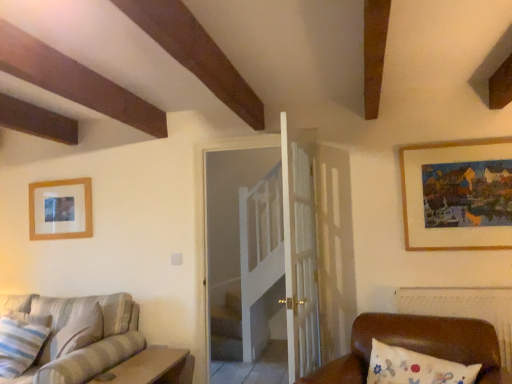
The image size is (512, 384). What do you see at coordinates (60, 209) in the screenshot? I see `matte white picture frame at upper left, which appears as the 1th picture frame when viewed from the back` at bounding box center [60, 209].

At what (x,y) coordinates should I click in order to perform the action: click on brown leather couch at lower right. Please return your answer as a coordinate pair (x, y). Looking at the image, I should click on (416, 346).

What do you see at coordinates (243, 250) in the screenshot?
I see `white wooden door at center` at bounding box center [243, 250].

What is the approximate height of striped fabric pillow at lower left?

20.71 inches.

You are a GUI agent. You are given a task and a screenshot of the screen. Output one action in this format:
    pyautogui.click(x=<x>, y=<y>)
    Task: Click on the matte white picture frame at upper left, placed as the 2th picture frame when sorted from front to back
    
    Given the screenshot: What is the action you would take?
    pyautogui.click(x=60, y=209)

Does point (269, 155) come farther from viewer compared to point (49, 192)?

Yes, it is.

Is white wooden door at center in front of matte white picture frame at upper left, which appears as the 1th picture frame when viewed from the back?

That is True.

Can you confirm if white wooden door at center is bigger than matte white picture frame at upper left, which appears as the 1th picture frame when viewed from the back?

Indeed, white wooden door at center has a larger size compared to matte white picture frame at upper left, which appears as the 1th picture frame when viewed from the back.

From a real-world perspective, is white wooden door at center located beneath matte white picture frame at upper left, which is the second picture frame in right-to-left order?

Yes, from a real-world perspective, white wooden door at center is beneath matte white picture frame at upper left, which is the second picture frame in right-to-left order.

In terms of size, does brown leather couch at lower right appear bigger or smaller than wooden framed painting at upper right, the 1th picture frame from the right?

In the image, brown leather couch at lower right appears to be larger than wooden framed painting at upper right, the 1th picture frame from the right.

How distant is brown leather couch at lower right from wooden framed painting at upper right, marked as the first picture frame in a front-to-back arrangement?

The distance of brown leather couch at lower right from wooden framed painting at upper right, marked as the first picture frame in a front-to-back arrangement, is 31.20 inches.

Looking at this image, is brown leather couch at lower right touching wooden framed painting at upper right, the 1th picture frame from the right?

No.

From a real-world perspective, does brown leather couch at lower right sit lower than wooden framed painting at upper right, the 1th picture frame from the right?

Correct, in the physical world, brown leather couch at lower right is lower than wooden framed painting at upper right, the 1th picture frame from the right.

Does wooden table at lower left come in front of wooden framed painting at upper right, marked as the first picture frame in a front-to-back arrangement?

Yes, wooden table at lower left is in front of wooden framed painting at upper right, marked as the first picture frame in a front-to-back arrangement.

Considering the positions of objects wooden table at lower left and wooden framed painting at upper right, which is the 2th picture frame in back-to-front order, in the image provided, who is more to the left, wooden table at lower left or wooden framed painting at upper right, which is the 2th picture frame in back-to-front order,?

wooden table at lower left.

From the image's perspective, which is below, wooden table at lower left or wooden framed painting at upper right, marked as the second picture frame in a left-to-right arrangement?

wooden table at lower left is shown below in the image.

Is the depth of striped fabric pillow at lower left greater than that of striped fabric couch at lower left?

Yes.

From the image's perspective, is striped fabric pillow at lower left on top of striped fabric couch at lower left?

Yes, from the image's perspective, striped fabric pillow at lower left is on top of striped fabric couch at lower left.

Find the location of a particular element. Image resolution: width=512 pixels, height=384 pixels. studio couch located on the right of striped fabric pillow at lower left is located at coordinates (79, 342).

Do you think matte white picture frame at upper left, which appears as the 1th picture frame when viewed from the back, is within striped fabric couch at lower left, or outside of it?

matte white picture frame at upper left, which appears as the 1th picture frame when viewed from the back, is not inside striped fabric couch at lower left, it's outside.

What's the angular difference between matte white picture frame at upper left, placed as the 2th picture frame when sorted from front to back, and striped fabric couch at lower left's facing directions?

The angle between the facing direction of matte white picture frame at upper left, placed as the 2th picture frame when sorted from front to back, and the facing direction of striped fabric couch at lower left is 0.0732 degrees.

From the image's perspective, is matte white picture frame at upper left, placed as the 2th picture frame when sorted from front to back, under striped fabric couch at lower left?

No, from the image's perspective, matte white picture frame at upper left, placed as the 2th picture frame when sorted from front to back, is not below striped fabric couch at lower left.

Is wooden table at lower left far from white wooden door at center?

Absolutely, wooden table at lower left is distant from white wooden door at center.

Is white wooden door at center at the back of wooden table at lower left?

No, wooden table at lower left is not facing away from white wooden door at center.

From a real-world perspective, who is located higher, wooden table at lower left or white wooden door at center?

From a 3D spatial view, white wooden door at center is above.

Can you confirm if wooden table at lower left is bigger than white wooden door at center?

No.

From the image's perspective, between matte white picture frame at upper left, placed as the 2th picture frame when sorted from front to back, and white wooden door at center, which one is located above?

matte white picture frame at upper left, placed as the 2th picture frame when sorted from front to back, from the image's perspective.

Is matte white picture frame at upper left, which is the second picture frame in right-to-left order, positioned with its back to white wooden door at center?

matte white picture frame at upper left, which is the second picture frame in right-to-left order, is not turned away from white wooden door at center.

Is matte white picture frame at upper left, which appears as the 1th picture frame when viewed from the back, further to the viewer compared to white wooden door at center?

That is True.

Is matte white picture frame at upper left, which is the second picture frame in right-to-left order, bigger or smaller than white wooden door at center?

matte white picture frame at upper left, which is the second picture frame in right-to-left order, is smaller than white wooden door at center.

At what (x,y) coordinates should I click in order to perform the action: click on glass door lying in front of the matte white picture frame at upper left, which is the second picture frame in right-to-left order. Please return your answer as a coordinate pair (x, y). Looking at the image, I should click on (243, 250).

Locate an element on the screen. The image size is (512, 384). furniture to the left of wooden framed painting at upper right, the 1th picture frame from the right is located at coordinates (416, 346).

Based on their spatial positions, is wooden table at lower left or striped fabric pillow at lower left closer to brown leather couch at lower right?

Based on the image, wooden table at lower left appears to be nearer to brown leather couch at lower right.

Estimate the real-world distances between objects in this image. Which object is further from wooden table at lower left, wooden framed painting at upper right, which is the 2th picture frame in back-to-front order, or striped fabric couch at lower left?

wooden framed painting at upper right, which is the 2th picture frame in back-to-front order, lies further to wooden table at lower left than the other object.

When comparing their distances from wooden framed painting at upper right, marked as the first picture frame in a front-to-back arrangement, does white wooden door at center or wooden table at lower left seem closer?

white wooden door at center is closer to wooden framed painting at upper right, marked as the first picture frame in a front-to-back arrangement.

When comparing their distances from white wooden door at center, does wooden framed painting at upper right, marked as the second picture frame in a left-to-right arrangement, or matte white picture frame at upper left, which appears as the 1th picture frame when viewed from the back, seem further?

Among the two, wooden framed painting at upper right, marked as the second picture frame in a left-to-right arrangement, is located further to white wooden door at center.

Based on their spatial positions, is wooden table at lower left or striped fabric couch at lower left closer to striped fabric pillow at lower left?

striped fabric couch at lower left is closer to striped fabric pillow at lower left.

Which object lies further to the anchor point matte white picture frame at upper left, which is counted as the 1th picture frame, starting from the left, wooden table at lower left or brown leather couch at lower right?

Among the two, brown leather couch at lower right is located further to matte white picture frame at upper left, which is counted as the 1th picture frame, starting from the left.

Considering their positions, is brown leather couch at lower right positioned closer to striped fabric couch at lower left than striped fabric pillow at lower left?

Based on the image, striped fabric pillow at lower left appears to be nearer to striped fabric couch at lower left.

Estimate the real-world distances between objects in this image. Which object is closer to brown leather couch at lower right, white wooden door at center or wooden framed painting at upper right, the 1th picture frame from the right?

wooden framed painting at upper right, the 1th picture frame from the right, is closer to brown leather couch at lower right.

Where is `table between matte white picture frame at upper left, placed as the 2th picture frame when sorted from front to back, and wooden framed painting at upper right, marked as the first picture frame in a front-to-back arrangement, from left to right`? The width and height of the screenshot is (512, 384). table between matte white picture frame at upper left, placed as the 2th picture frame when sorted from front to back, and wooden framed painting at upper right, marked as the first picture frame in a front-to-back arrangement, from left to right is located at coordinates (147, 367).

I want to click on table between striped fabric couch at lower left and wooden framed painting at upper right, marked as the second picture frame in a left-to-right arrangement, so click(147, 367).

Locate an element on the screen. table situated between striped fabric pillow at lower left and wooden framed painting at upper right, marked as the first picture frame in a front-to-back arrangement, from left to right is located at coordinates (147, 367).

Find the location of `table located between matte white picture frame at upper left, which is counted as the 1th picture frame, starting from the left, and white wooden door at center in the left-right direction`. table located between matte white picture frame at upper left, which is counted as the 1th picture frame, starting from the left, and white wooden door at center in the left-right direction is located at coordinates (147, 367).